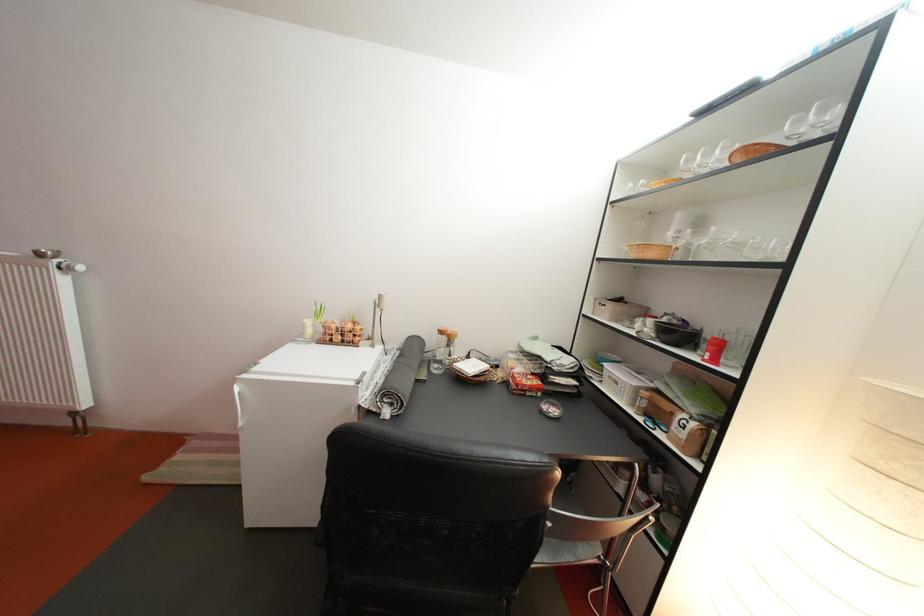
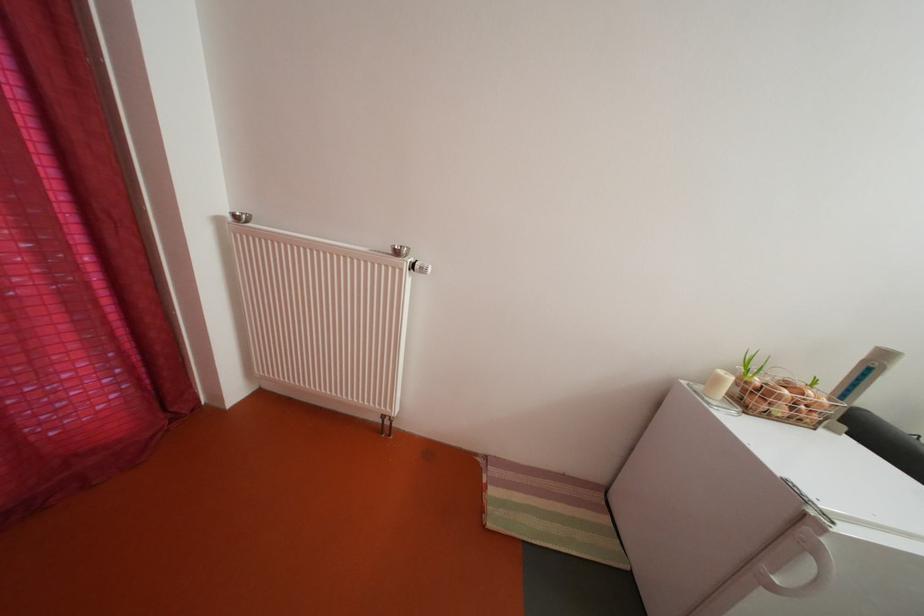
In the second image, find the point that corresponds to [348,344] in the first image.

(792, 416)